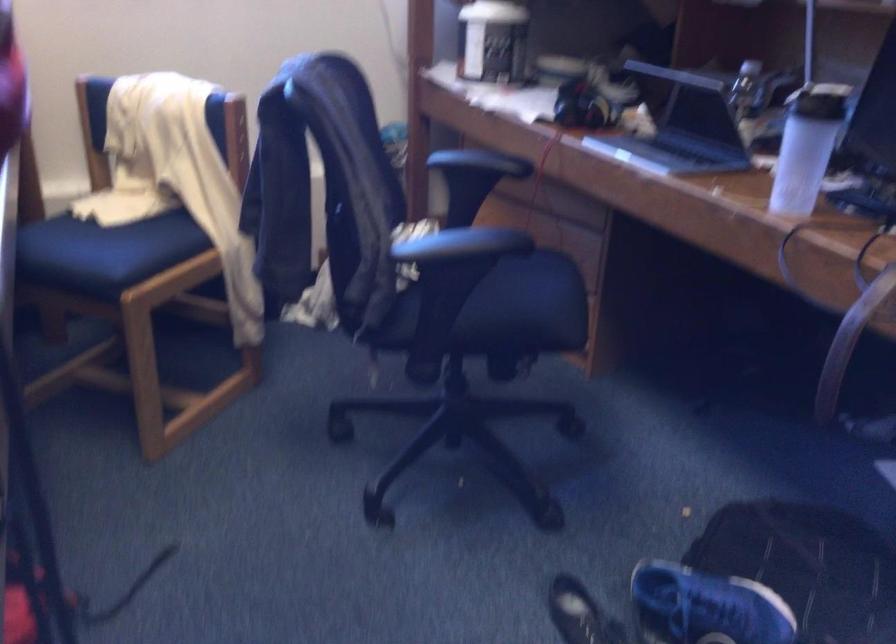
Question: The images are taken continuously from a first-person perspective. In which direction is your viewpoint rotating?

Choices:
 (A) Left
 (B) Right
 (C) Up
 (D) Down

Answer: (B)